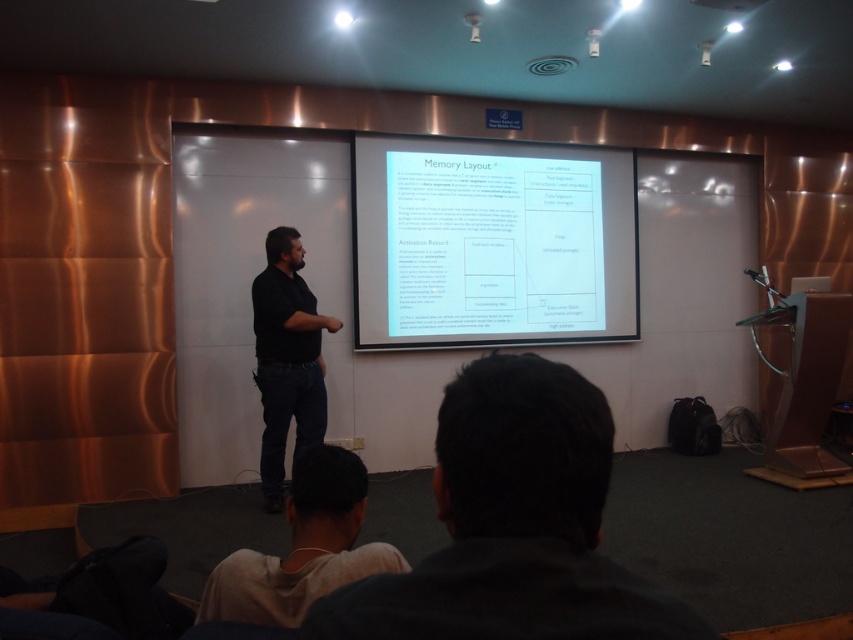
Question: Considering the relative positions of dark hair at lower center and white fabric shirt at lower center in the image provided, where is dark hair at lower center located with respect to white fabric shirt at lower center?

Choices:
 (A) above
 (B) below

Answer: (A)

Question: Is white paper at center wider than black matte shirt at center?

Choices:
 (A) no
 (B) yes

Answer: (B)

Question: Which object appears farthest from the camera in this image?

Choices:
 (A) black matte shirt at center
 (B) white paper at center
 (C) dark hair at lower center

Answer: (B)

Question: Which object is the farthest from the dark hair at lower center?

Choices:
 (A) white paper at center
 (B) black matte shirt at center

Answer: (A)

Question: Does dark hair at lower center come in front of white fabric shirt at lower center?

Choices:
 (A) no
 (B) yes

Answer: (B)

Question: Considering the real-world distances, which object is farthest from the black matte shirt at center?

Choices:
 (A) dark hair at lower center
 (B) white paper at center
 (C) white fabric shirt at lower center

Answer: (A)